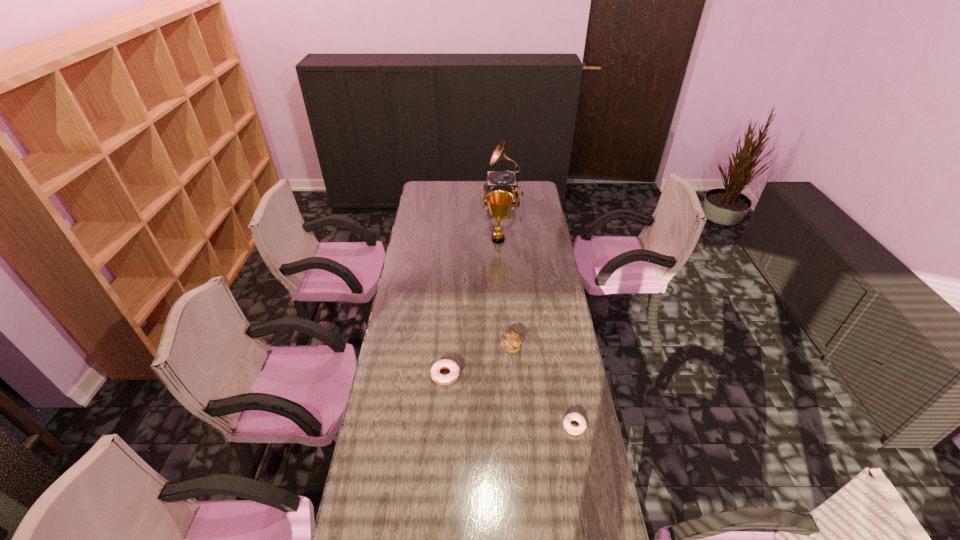
Find the location of a particular element. This screenshot has width=960, height=540. vacant space that is in between the muffin and the award is located at coordinates (504, 293).

This screenshot has height=540, width=960. What are the coordinates of `empty space that is in between the third shortest object and the second farthest object` in the screenshot? It's located at coord(504,293).

Identify which object is the third closest to the third farthest object. Please provide its 2D coordinates. Your answer should be formatted as a tuple, i.e. [(x, y)], where the tuple contains the x and y coordinates of a point satisfying the conditions above.

[(499, 201)]

Identify which object is the fourth nearest to the rightmost object. Please provide its 2D coordinates. Your answer should be formatted as a tuple, i.e. [(x, y)], where the tuple contains the x and y coordinates of a point satisfying the conditions above.

[(506, 180)]

This screenshot has width=960, height=540. What are the coordinates of `free space that satisfies the following two spatial constraints: 1. on the front view with handles of the award; 2. on the right side of the third tallest object` in the screenshot? It's located at (504, 347).

In order to click on vacant space that satisfies the following two spatial constraints: 1. on the horn of the record player; 2. on the front side of the taller doughnut in this screenshot , I will do `click(516, 375)`.

Locate an element on the screen. This screenshot has width=960, height=540. free space that satisfies the following two spatial constraints: 1. on the horn of the record player; 2. on the left side of the shorter doughnut is located at coordinates (519, 426).

Identify the location of free location that satisfies the following two spatial constraints: 1. on the back side of the second nearest object; 2. on the left side of the third shortest object. The image size is (960, 540). (447, 347).

The image size is (960, 540). I want to click on blank space that satisfies the following two spatial constraints: 1. on the front view with handles of the rightmost object; 2. on the left side of the award, so [508, 426].

Identify the location of free space that satisfies the following two spatial constraints: 1. on the horn of the farthest object; 2. on the front view with handles of the award. (506, 240).